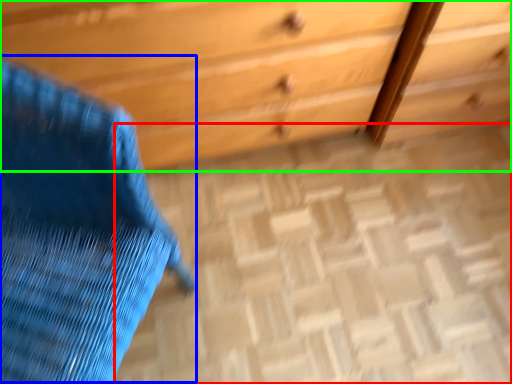
Question: Which object is the closest to the plain (highlighted by a red box)? Choose among these: swivel chair (highlighted by a blue box) or chest of drawers (highlighted by a green box).

Choices:
 (A) swivel chair
 (B) chest of drawers

Answer: (B)